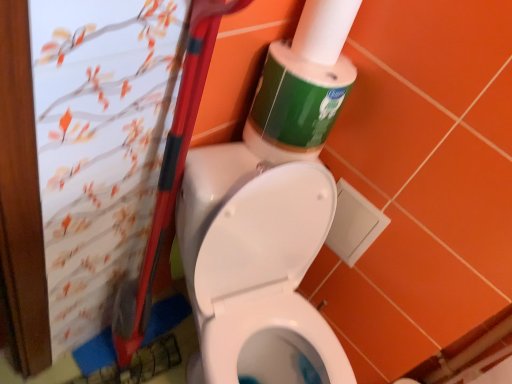
Question: From their relative heights in the image, would you say green matte toilet paper at upper right is taller or shorter than green matte toilet paper at upper center?

Choices:
 (A) short
 (B) tall

Answer: (B)

Question: Would you say green matte toilet paper at upper right is inside or outside green matte toilet paper at upper center?

Choices:
 (A) inside
 (B) outside

Answer: (B)

Question: Does point (360, 1) appear closer or farther from the camera than point (332, 18)?

Choices:
 (A) closer
 (B) farther

Answer: (B)

Question: Is point (347, 11) positioned closer to the camera than point (316, 38)?

Choices:
 (A) closer
 (B) farther

Answer: (A)

Question: Is green matte toilet paper at upper center in front of or behind green matte toilet paper at upper right in the image?

Choices:
 (A) behind
 (B) front

Answer: (A)

Question: In terms of width, does green matte toilet paper at upper center look wider or thinner when compared to green matte toilet paper at upper right?

Choices:
 (A) wide
 (B) thin

Answer: (A)

Question: Based on their sizes in the image, would you say green matte toilet paper at upper center is bigger or smaller than green matte toilet paper at upper right?

Choices:
 (A) small
 (B) big

Answer: (B)